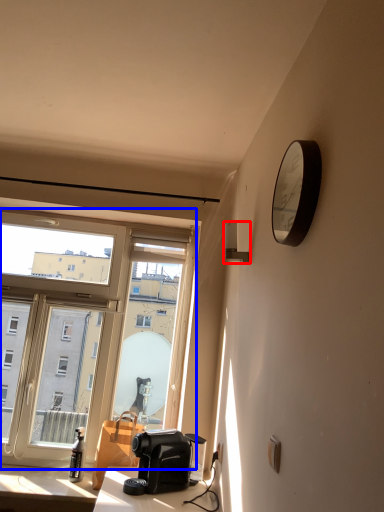
Question: Which point is closer to the camera, lamp (highlighted by a red box) or window (highlighted by a blue box)?

Choices:
 (A) lamp
 (B) window

Answer: (A)